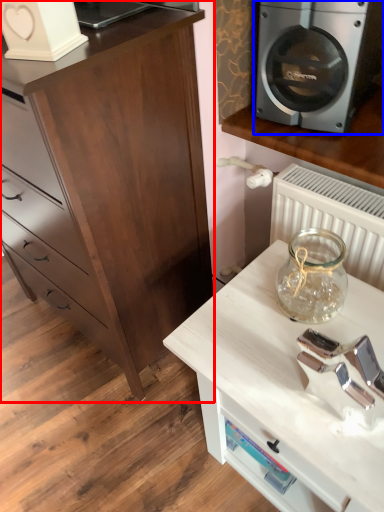
Question: Which object appears closest to the camera in this image, chest of drawers (highlighted by a red box) or home appliance (highlighted by a blue box)?

Choices:
 (A) chest of drawers
 (B) home appliance

Answer: (A)